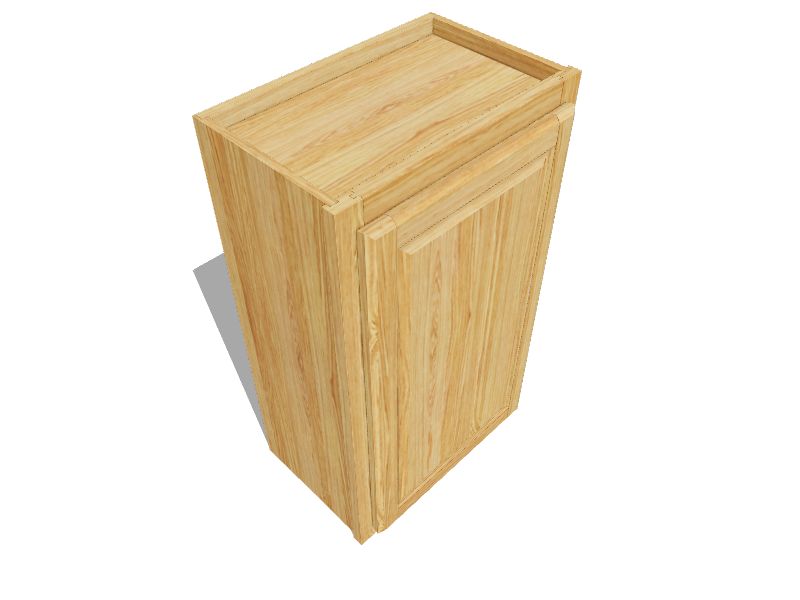
This screenshot has width=800, height=600. Identify the location of wood box. (474, 370).